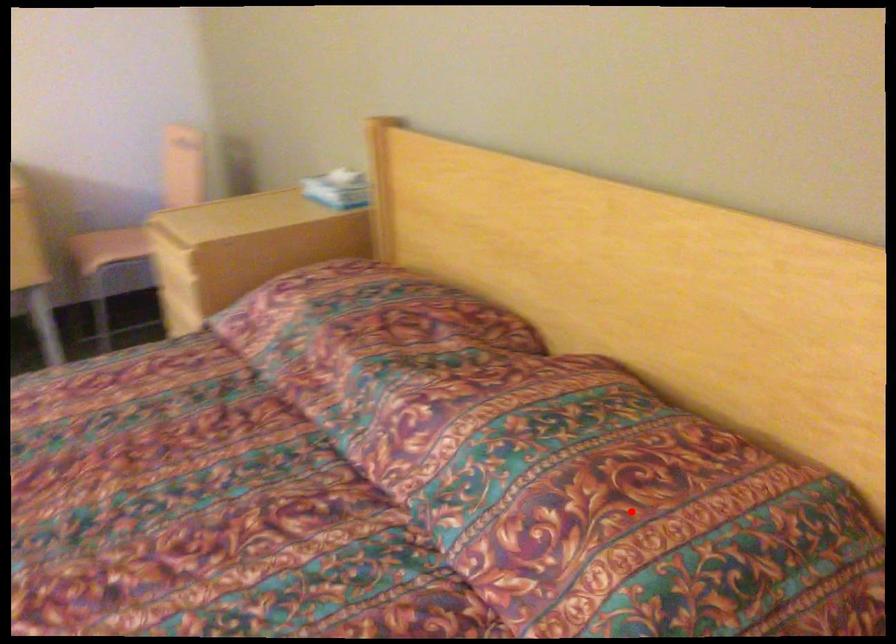
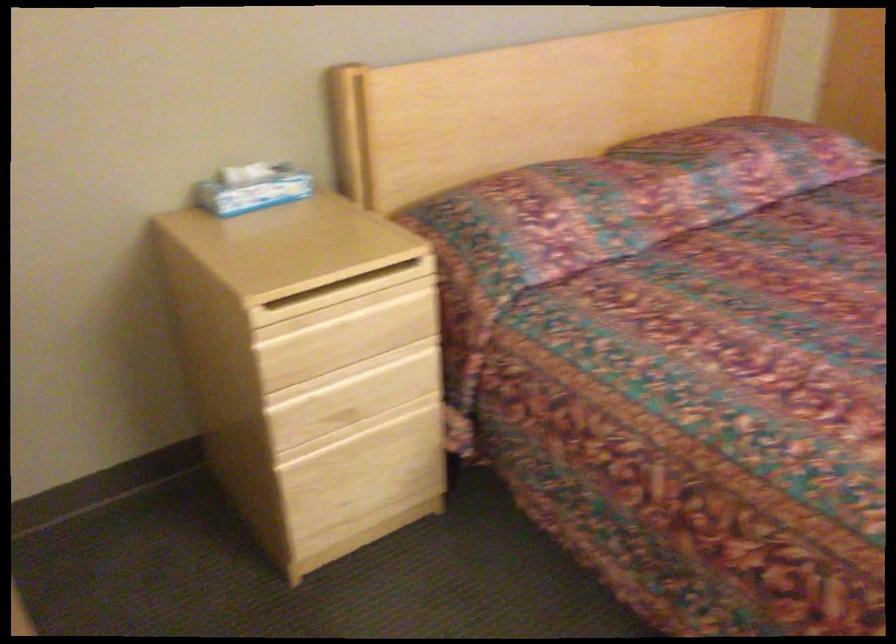
Question: I am providing you with two images of the same scene from different viewpoints. A red point is marked on the first image. At the location where the point appears in image 1, is it still visible in image 2?

Choices:
 (A) Yes
 (B) No

Answer: (B)